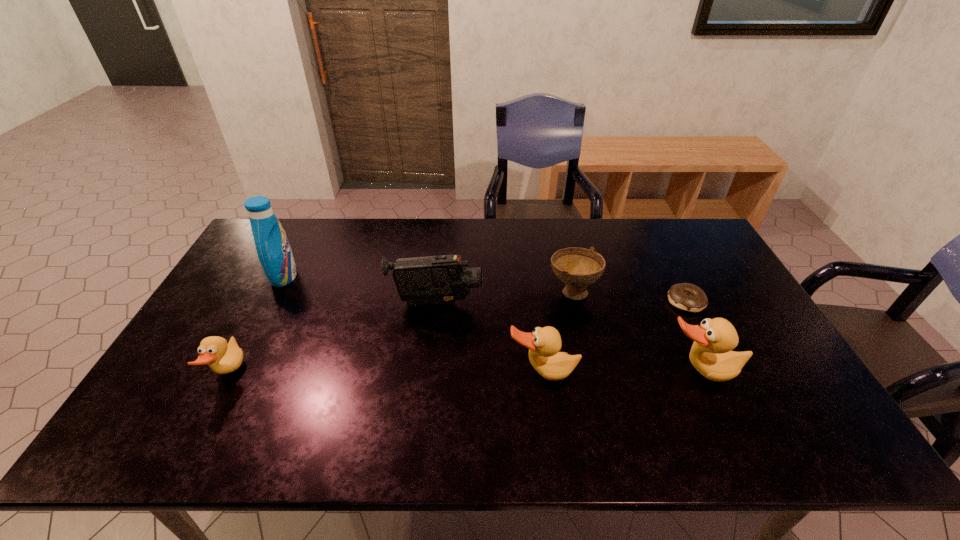
Where is `vacant space at the near edge of the desktop`? vacant space at the near edge of the desktop is located at coordinates (375, 386).

Identify the location of vacant area at the left edge. (245, 291).

At what (x,y) coordinates should I click in order to perform the action: click on vacant position at the right edge of the desktop. Please return your answer as a coordinate pair (x, y). The image size is (960, 540). Looking at the image, I should click on (756, 343).

At what (x,y) coordinates should I click in order to perform the action: click on free spot at the far right corner of the desktop. Please return your answer as a coordinate pair (x, y). This screenshot has height=540, width=960. Looking at the image, I should click on (686, 235).

Locate an element on the screen. empty location between the shortest duck and the camcorder is located at coordinates (332, 339).

The width and height of the screenshot is (960, 540). Identify the location of free space between the shortest object and the soup bowl. (629, 296).

Where is `free space between the tallest object and the shortest duck`? The image size is (960, 540). free space between the tallest object and the shortest duck is located at coordinates (256, 325).

I want to click on empty location between the rightmost duck and the shortest duck, so click(x=464, y=373).

At what (x,y) coordinates should I click in order to perform the action: click on empty location between the second duck from right to left and the shortest object. Please return your answer as a coordinate pair (x, y). This screenshot has width=960, height=540. Looking at the image, I should click on (614, 337).

Where is `free space that is in between the third object from left to right and the second duck from left to right`? This screenshot has width=960, height=540. free space that is in between the third object from left to right and the second duck from left to right is located at coordinates (490, 338).